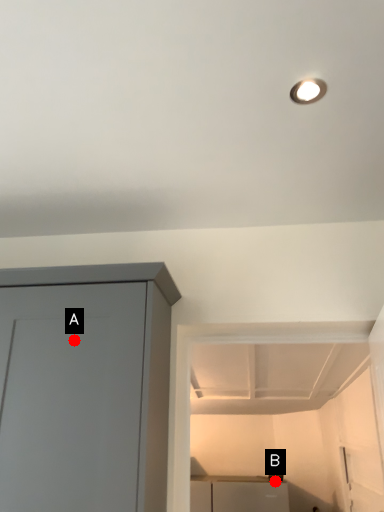
Question: Two points are circled on the image, labeled by A and B beside each circle. Which point appears farthest from the camera in this image?

Choices:
 (A) A is further
 (B) B is further

Answer: (B)